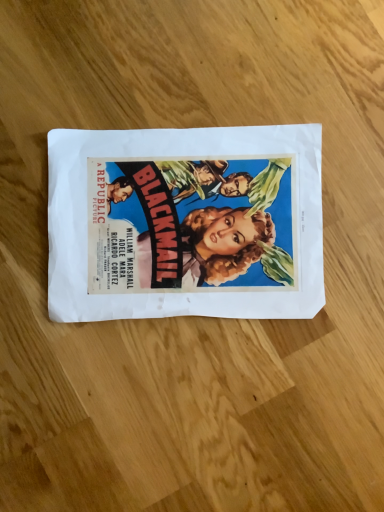
Locate an element on the screen. free spot above matte paper poster at center (from a real-world perspective) is located at coordinates (189, 220).